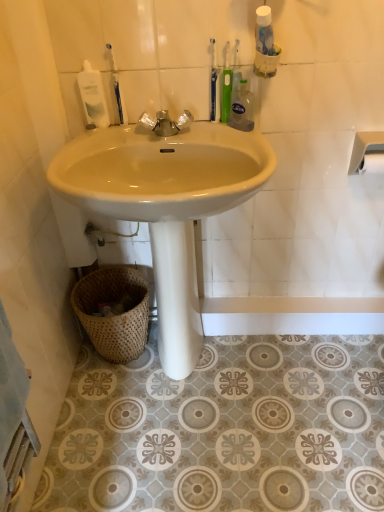
This screenshot has height=512, width=384. What are the coordinates of `free space to the left of matte silver faucet at center` in the screenshot? It's located at (103, 139).